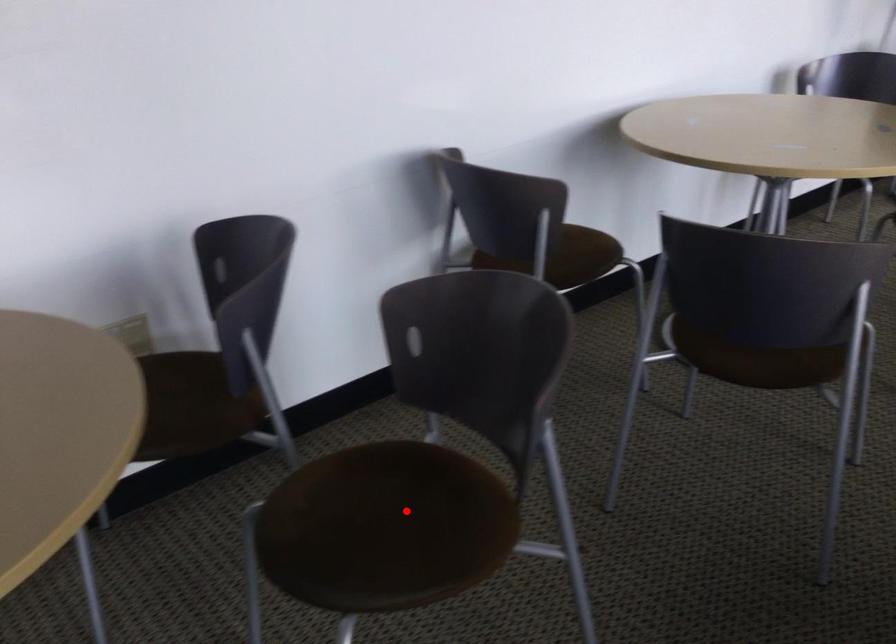
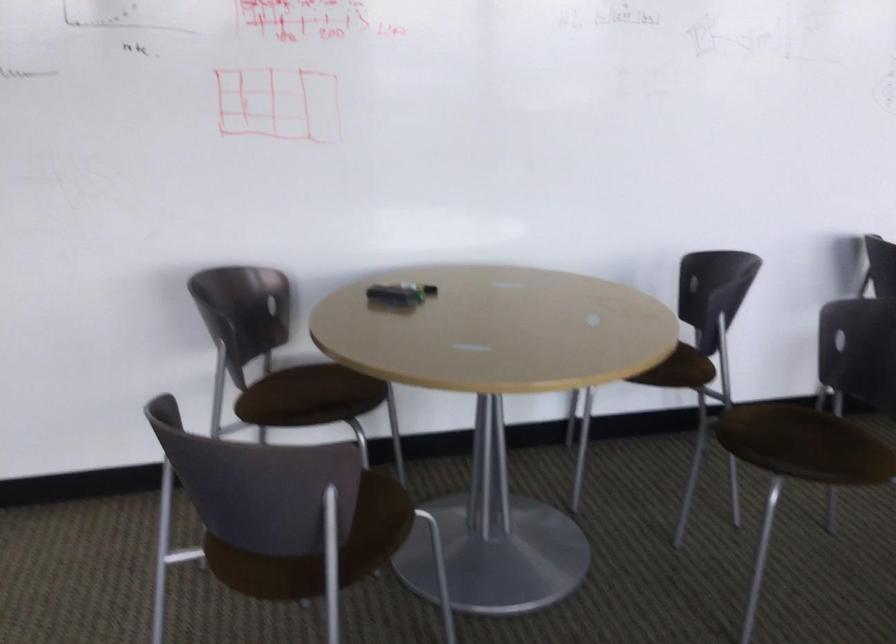
Question: I am providing you with two images of the same scene from different viewpoints. In image1, a red point is highlighted. Considering the same 3D point in image2, which of the following is correct?

Choices:
 (A) It is closer
 (B) It is farther

Answer: (B)